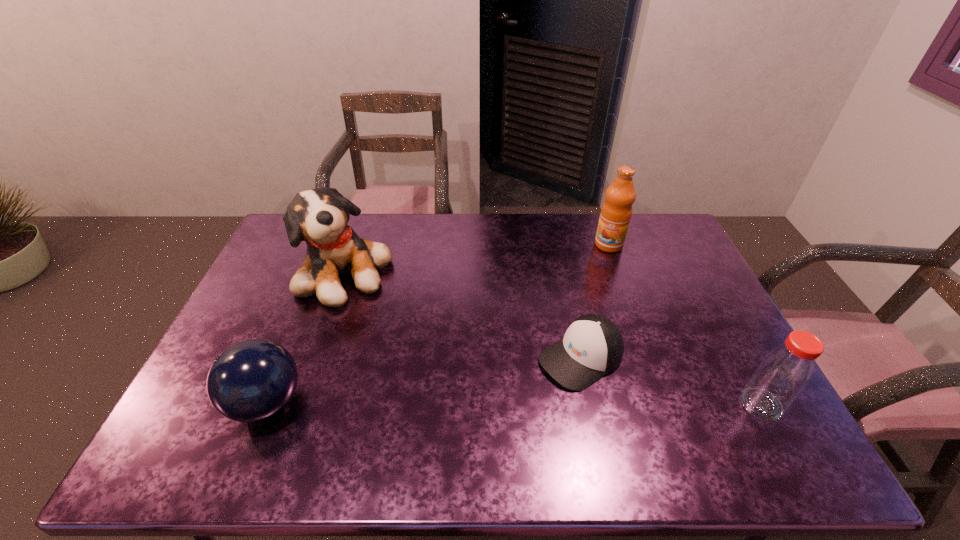
The image size is (960, 540). In the image, there is a desktop. What are the coordinates of `vacant space at the near edge` in the screenshot? It's located at (313, 409).

At what (x,y) coordinates should I click in order to perform the action: click on free space at the right edge of the desktop. Please return your answer as a coordinate pair (x, y). The width and height of the screenshot is (960, 540). Looking at the image, I should click on (698, 372).

The height and width of the screenshot is (540, 960). In order to click on free space at the far left corner of the desktop in this screenshot , I will do `click(284, 230)`.

Identify the location of vacant region at the far right corner of the desktop. The height and width of the screenshot is (540, 960). (651, 237).

The image size is (960, 540). Identify the location of vacant region at the near right corner. (729, 408).

You are a GUI agent. You are given a task and a screenshot of the screen. Output one action in this format:
    pyautogui.click(x=<x>, y=<y>)
    Task: Click on the vacant area that lies between the fruit juice and the rightmost object
    The image size is (960, 540).
    Given the screenshot: What is the action you would take?
    pyautogui.click(x=685, y=325)

Locate an element on the screen. The height and width of the screenshot is (540, 960). free spot between the second object from right to left and the puppy is located at coordinates (477, 259).

Where is `free space between the third tallest object and the puppy`? free space between the third tallest object and the puppy is located at coordinates (554, 339).

I want to click on unoccupied area between the shortest object and the puppy, so click(x=464, y=316).

You are a GUI agent. You are given a task and a screenshot of the screen. Output one action in this format:
    pyautogui.click(x=<x>, y=<y>)
    Task: Click on the unoccupied position between the rightmost object and the second shortest object
    This screenshot has height=540, width=960.
    Given the screenshot: What is the action you would take?
    pyautogui.click(x=514, y=403)